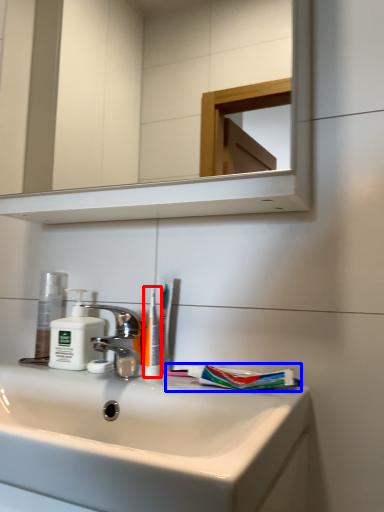
Question: Which object appears farthest to the camera in this image, toothbrush (highlighted by a red box) or toothpaste (highlighted by a blue box)?

Choices:
 (A) toothbrush
 (B) toothpaste

Answer: (A)